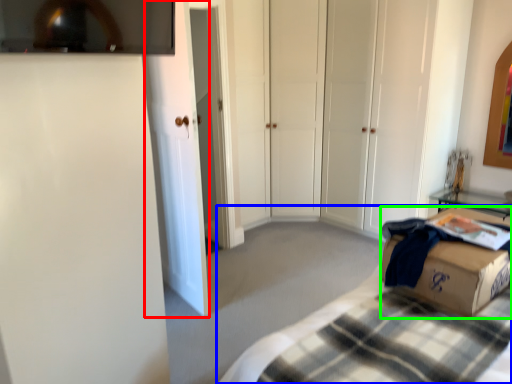
Question: Considering the real-world distances, which object is closest to glass door (highlighted by a red box)? bed (highlighted by a blue box) or box (highlighted by a green box).

Choices:
 (A) bed
 (B) box

Answer: (A)